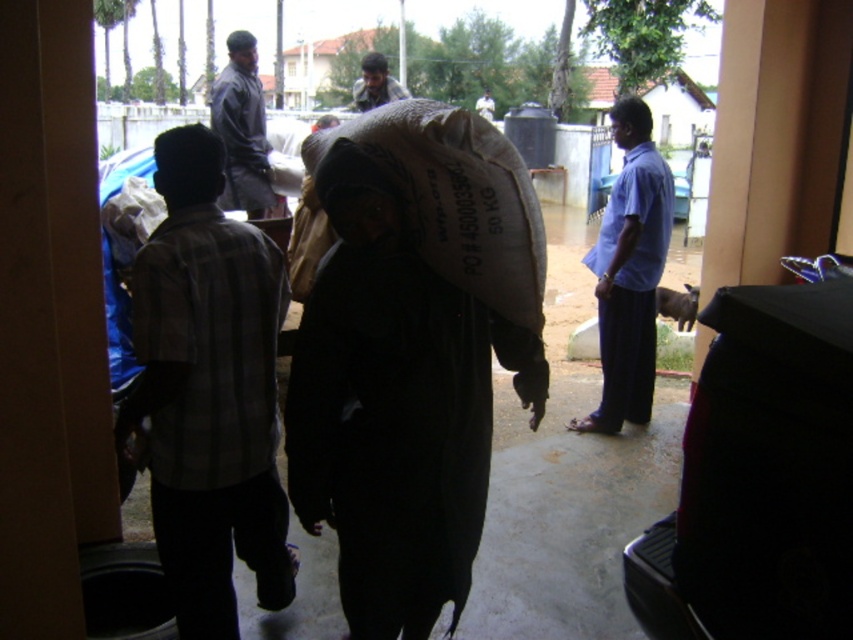
Is dark matte bag at center below blue cotton shirt at right?

Correct, dark matte bag at center is located below blue cotton shirt at right.

Which is above, dark matte bag at center or blue cotton shirt at right?

blue cotton shirt at right is above.

Which is in front, point (370, 218) or point (614, 182)?

Positioned in front is point (370, 218).

Find the location of a particular element. Image resolution: width=853 pixels, height=640 pixels. dark matte bag at center is located at coordinates (395, 406).

Can you confirm if plaid cotton shirt at center is wider than dark gray fabric bag at center?

Incorrect, plaid cotton shirt at center's width does not surpass dark gray fabric bag at center's.

Does plaid cotton shirt at center have a smaller size compared to dark gray fabric bag at center?

Correct, plaid cotton shirt at center occupies less space than dark gray fabric bag at center.

Image resolution: width=853 pixels, height=640 pixels. Identify the location of plaid cotton shirt at center. (209, 392).

I want to click on plaid cotton shirt at center, so click(x=209, y=392).

Looking at this image, who is shorter, dark blue shirt at upper left or dark gray fabric bag at center?

dark blue shirt at upper left is shorter.

Can you confirm if dark blue shirt at upper left is taller than dark gray fabric bag at center?

No, dark blue shirt at upper left is not taller than dark gray fabric bag at center.

Identify the location of dark blue shirt at upper left. (242, 129).